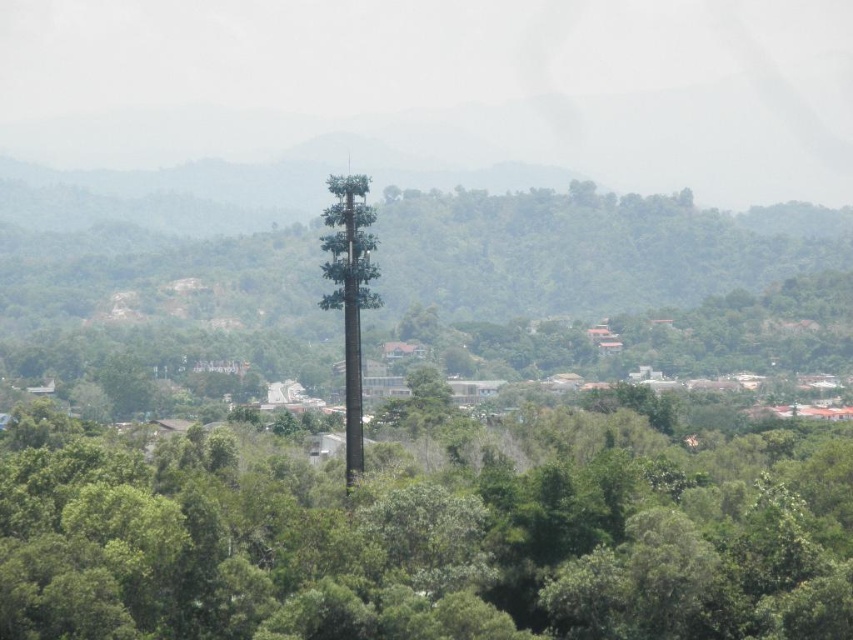
Does green matte pole at center come behind green matte tower at center?

No, green matte pole at center is in front of green matte tower at center.

Between point (469, 464) and point (360, 307), which one is positioned in front?

Point (360, 307)

Measure the distance between green matte pole at center and camera.

green matte pole at center and camera are 106.91 meters apart from each other.

Locate an element on the screen. green matte pole at center is located at coordinates (419, 541).